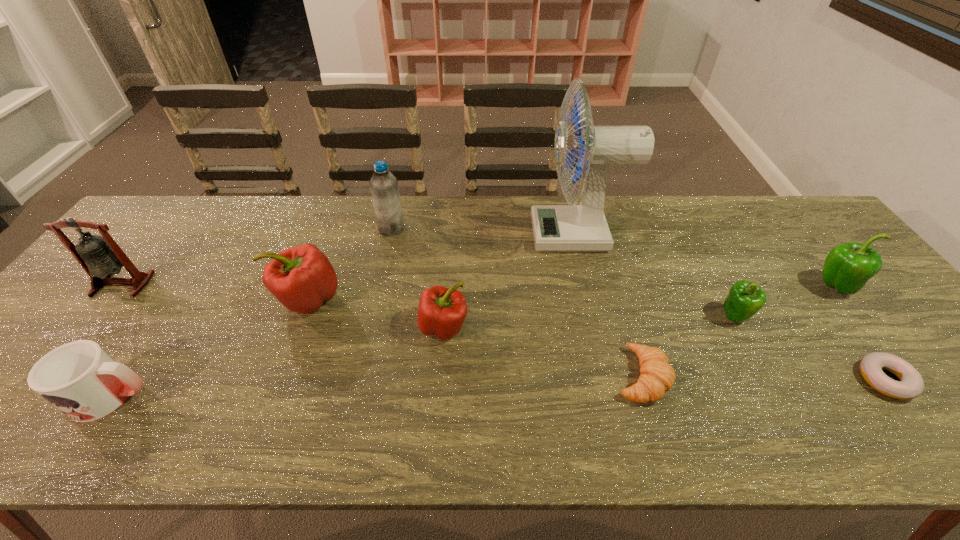
Identify the location of free space located on the back of the blue water bottle. The image size is (960, 540). (397, 202).

Locate an element on the screen. This screenshot has width=960, height=540. vacant space located 0.080m on the back of the bell is located at coordinates (148, 252).

Find the location of `free region located 0.120m on the front of the rightmost bell pepper`. free region located 0.120m on the front of the rightmost bell pepper is located at coordinates (876, 339).

Locate an element on the screen. The height and width of the screenshot is (540, 960). vacant space located 0.070m on the right of the leftmost bell pepper is located at coordinates (368, 299).

Locate an element on the screen. This screenshot has height=540, width=960. vacant space located 0.300m on the front of the smaller green bell pepper is located at coordinates (805, 446).

Identify the location of vacant area situated on the front of the second bell pepper from left to right. click(x=435, y=450).

This screenshot has width=960, height=540. Find the location of `free space located on the side of the second object from left to right with the handle`. free space located on the side of the second object from left to right with the handle is located at coordinates (243, 396).

Find the location of `vacant position located on the left of the crescent roll`. vacant position located on the left of the crescent roll is located at coordinates (460, 375).

Find the location of a particular element. This screenshot has height=540, width=960. vacant space located 0.090m on the back of the brown doughnut is located at coordinates (847, 328).

Locate an element on the screen. The image size is (960, 540). fan that is at the far edge is located at coordinates (x=584, y=227).